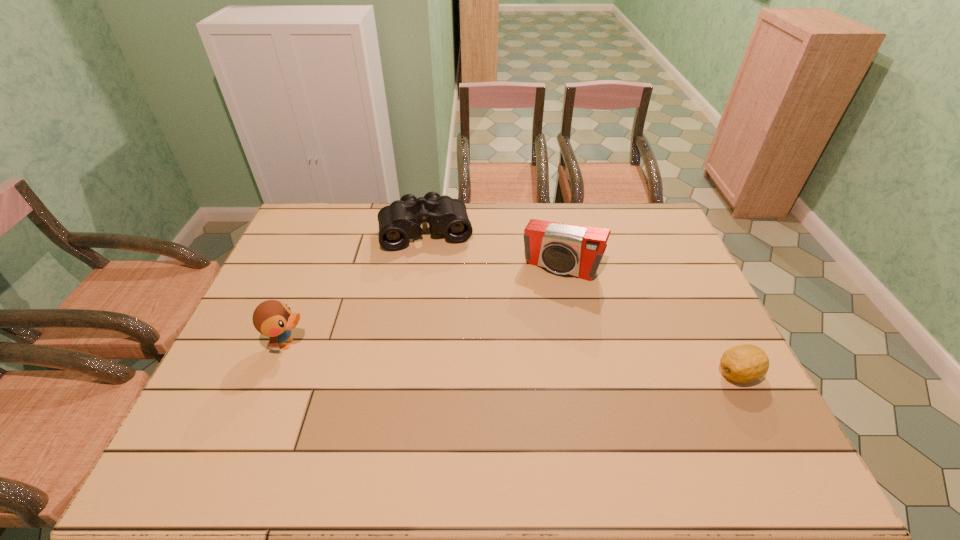
The image size is (960, 540). I want to click on vacant region at the far edge of the desktop, so click(507, 234).

The width and height of the screenshot is (960, 540). In the image, there is a desktop. Identify the location of vacant space at the near edge. (434, 414).

In the image, there is a desktop. Identify the location of vacant space at the left edge. The image size is (960, 540). (313, 276).

You are a GUI agent. You are given a task and a screenshot of the screen. Output one action in this format:
    pyautogui.click(x=<x>, y=<y>)
    Task: Click on the vacant point at the right edge
    This screenshot has height=540, width=960.
    Given the screenshot: What is the action you would take?
    pyautogui.click(x=652, y=306)

This screenshot has width=960, height=540. What are the coordinates of `vacant region at the far right corner of the desktop` in the screenshot? It's located at (643, 219).

At what (x,y) coordinates should I click in order to perform the action: click on free space between the leftmost object and the third object from left to right. Please return your answer as a coordinate pair (x, y). The width and height of the screenshot is (960, 540). Looking at the image, I should click on (424, 305).

Find the location of a particular element. The height and width of the screenshot is (540, 960). unoccupied position between the binoculars and the camera is located at coordinates (493, 249).

Where is `free space between the second nearest object and the shortest object`? free space between the second nearest object and the shortest object is located at coordinates (514, 359).

I want to click on vacant area between the second nearest object and the binoculars, so click(x=357, y=287).

The width and height of the screenshot is (960, 540). In order to click on free space between the second object from right to left and the nearest object in this screenshot , I will do `click(650, 320)`.